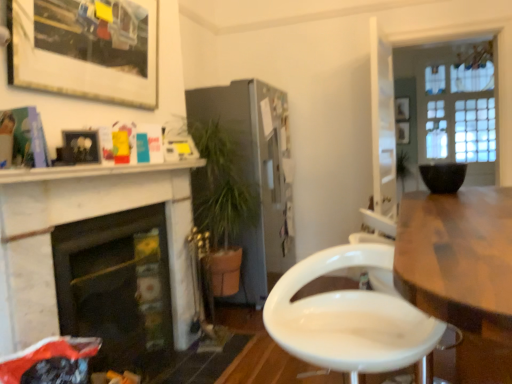
Question: Should I look upward or downward to see black matte bowl at upper right?

Choices:
 (A) down
 (B) up

Answer: (B)

Question: Is wooden table at right inside white marble fireplace at left, which is the second fireplace from back to front?

Choices:
 (A) no
 (B) yes

Answer: (A)

Question: Is white marble fireplace at left, which ranks as the 1th fireplace in front-to-back order, completely or partially outside of wooden table at right?

Choices:
 (A) yes
 (B) no

Answer: (A)

Question: Does white marble fireplace at left, which is the second fireplace from back to front, have a lesser height compared to wooden table at right?

Choices:
 (A) yes
 (B) no

Answer: (B)

Question: Are white marble fireplace at left, which is the second fireplace from back to front, and wooden table at right far apart?

Choices:
 (A) yes
 (B) no

Answer: (A)

Question: Considering the relative positions of white marble fireplace at left, which is the second fireplace from back to front, and wooden table at right in the image provided, is white marble fireplace at left, which is the second fireplace from back to front, to the left of wooden table at right from the viewer's perspective?

Choices:
 (A) yes
 (B) no

Answer: (A)

Question: Does white marble fireplace at left, which is the second fireplace from back to front, have a smaller size compared to wooden table at right?

Choices:
 (A) no
 (B) yes

Answer: (B)

Question: Is matte black picture frame at upper left, acting as the 3th picture frame starting from the back, taller than white marble fireplace at left, which ranks as the 1th fireplace in front-to-back order?

Choices:
 (A) no
 (B) yes

Answer: (A)

Question: Considering the relative sizes of matte black picture frame at upper left, the fourth picture frame from the top, and white marble fireplace at left, which is the second fireplace from back to front, in the image provided, is matte black picture frame at upper left, the fourth picture frame from the top, thinner than white marble fireplace at left, which is the second fireplace from back to front,?

Choices:
 (A) yes
 (B) no

Answer: (A)

Question: Can you confirm if matte black picture frame at upper left, positioned as the second picture frame in front-to-back order, is wider than white marble fireplace at left, which is the second fireplace from back to front?

Choices:
 (A) yes
 (B) no

Answer: (B)

Question: Considering the relative positions of matte black picture frame at upper left, positioned as the second picture frame in front-to-back order, and white marble fireplace at left, which ranks as the 1th fireplace in front-to-back order, in the image provided, is matte black picture frame at upper left, positioned as the second picture frame in front-to-back order, behind white marble fireplace at left, which ranks as the 1th fireplace in front-to-back order,?

Choices:
 (A) yes
 (B) no

Answer: (A)

Question: From a real-world perspective, does matte black picture frame at upper left, acting as the 3th picture frame starting from the back, sit lower than white marble fireplace at left, which ranks as the 1th fireplace in front-to-back order?

Choices:
 (A) yes
 (B) no

Answer: (B)

Question: Can you confirm if matte black picture frame at upper left, the second picture frame positioned from the left, is smaller than white marble fireplace at left, which is the second fireplace from back to front?

Choices:
 (A) yes
 (B) no

Answer: (A)

Question: Considering the relative sizes of wooden picture frame at upper right, the fourth picture frame from the left, and white marble fireplace at left, which ranks as the 1th fireplace in front-to-back order, in the image provided, is wooden picture frame at upper right, the fourth picture frame from the left, thinner than white marble fireplace at left, which ranks as the 1th fireplace in front-to-back order,?

Choices:
 (A) yes
 (B) no

Answer: (A)